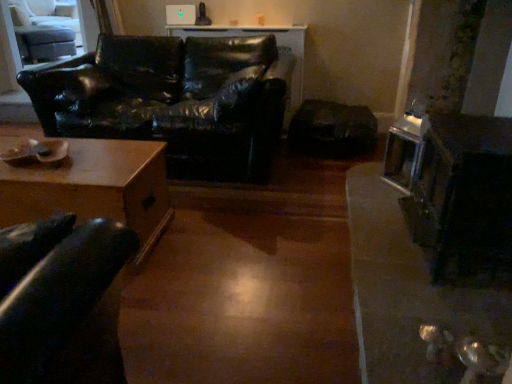
Question: From a real-world perspective, is light gray fabric swivel chair at upper left physically located above or below black leather couch at left?

Choices:
 (A) above
 (B) below

Answer: (A)

Question: Is light gray fabric swivel chair at upper left inside the boundaries of black leather couch at left, or outside?

Choices:
 (A) outside
 (B) inside

Answer: (A)

Question: Which is nearer to the metallic silver fireplace at right?

Choices:
 (A) black leather couch at left
 (B) wooden table at lower left
 (C) light gray fabric swivel chair at upper left

Answer: (B)

Question: Which is farther from the light gray fabric swivel chair at upper left?

Choices:
 (A) black leather couch at left
 (B) metallic silver fireplace at right
 (C) wooden table at lower left

Answer: (B)